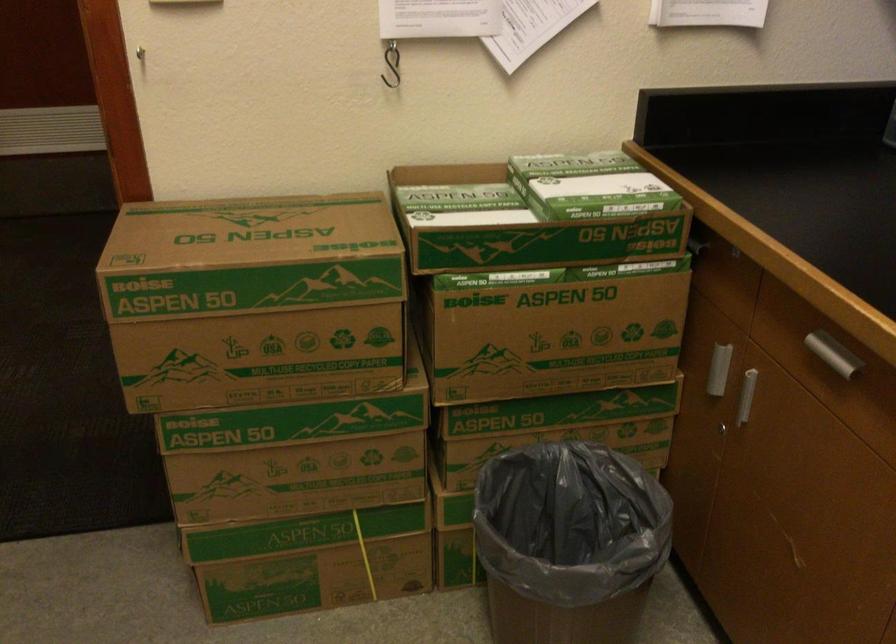
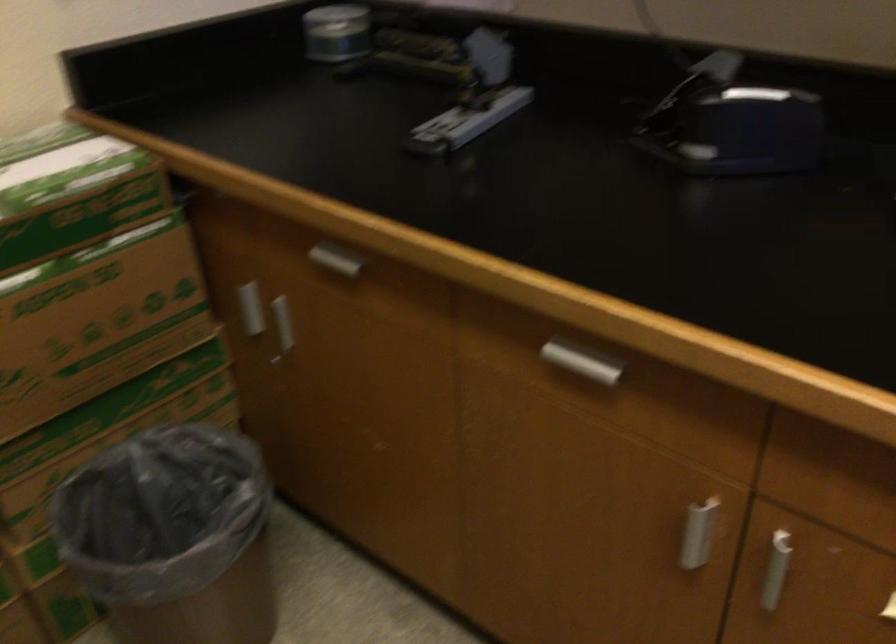
Find the pixel in the second image that matches (x=737, y=400) in the first image.

(280, 327)